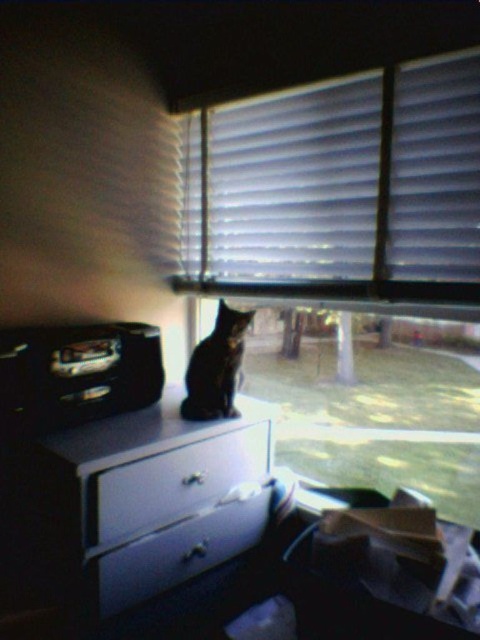
Can you confirm if white glossy drawer at center is bigger than shiny black cat at center?

Indeed, white glossy drawer at center has a larger size compared to shiny black cat at center.

Between white glossy drawer at center and shiny black cat at center, which one has more height?

shiny black cat at center is taller.

Does point (152, 572) come behind point (197, 387)?

No, it is in front of (197, 387).

Locate an element on the screen. white glossy drawer at center is located at coordinates (180, 552).

Is metallic black radio at left shorter than white glossy drawer at center?

No.

Who is positioned more to the left, metallic black radio at left or white glossy drawer at center?

metallic black radio at left is more to the left.

This screenshot has width=480, height=640. Describe the element at coordinates (76, 372) in the screenshot. I see `metallic black radio at left` at that location.

Locate an element on the screen. metallic black radio at left is located at coordinates (76, 372).

Looking at this image, is metallic black radio at left to the left of shiny black cat at center from the viewer's perspective?

Indeed, metallic black radio at left is positioned on the left side of shiny black cat at center.

Which is in front, point (108, 364) or point (231, 333)?

Point (108, 364)

Image resolution: width=480 pixels, height=640 pixels. Identify the location of metallic black radio at left. (76, 372).